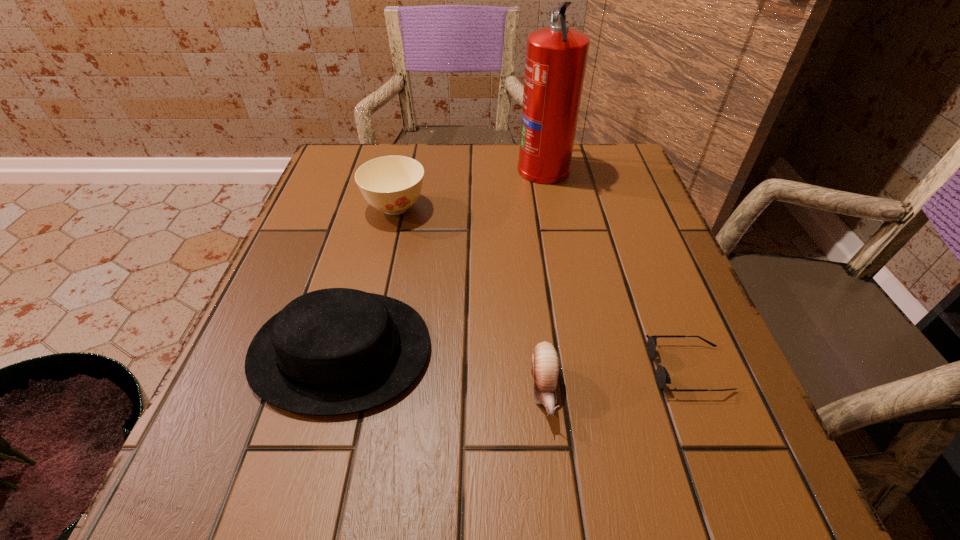
Where is `free space that is in between the fedora and the fire extinguisher`? The height and width of the screenshot is (540, 960). free space that is in between the fedora and the fire extinguisher is located at coordinates (443, 259).

In order to click on vacant space that's between the rightmost object and the tallest object in this screenshot , I will do `click(615, 268)`.

Find the location of `free area in between the tallest object and the second farthest object`. free area in between the tallest object and the second farthest object is located at coordinates pyautogui.click(x=469, y=188).

The height and width of the screenshot is (540, 960). Find the location of `vacant space that's between the fedora and the shortest object`. vacant space that's between the fedora and the shortest object is located at coordinates (515, 360).

Image resolution: width=960 pixels, height=540 pixels. I want to click on vacant area that lies between the tallest object and the sugar bowl, so click(469, 188).

I want to click on free spot between the fire extinguisher and the sugar bowl, so click(x=469, y=188).

I want to click on empty space between the tallest object and the escargot, so click(x=543, y=279).

Where is `object that is the closest one to the farthest object`? This screenshot has height=540, width=960. object that is the closest one to the farthest object is located at coordinates (392, 184).

At what (x,y) coordinates should I click in order to perform the action: click on object that can be found as the third closest to the farthest object. Please return your answer as a coordinate pair (x, y). Looking at the image, I should click on (662, 376).

I want to click on free space that satisfies the following two spatial constraints: 1. on the instruction side of the tallest object; 2. on the front side of the second farthest object, so (551, 208).